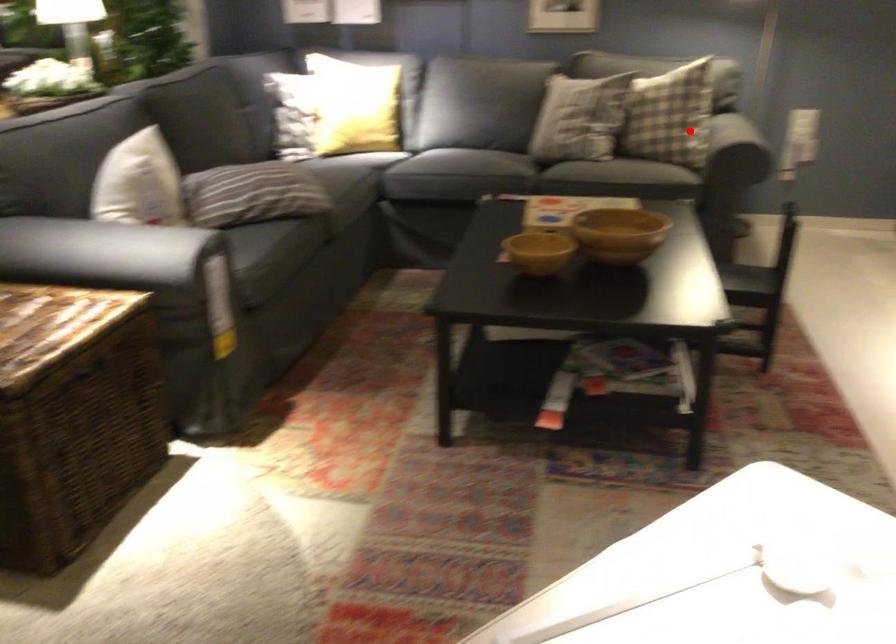
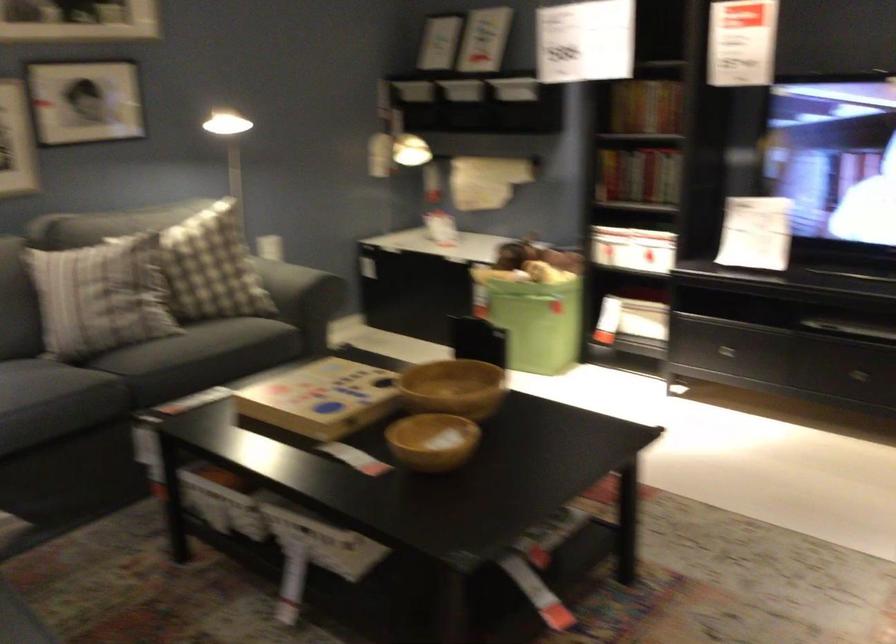
Locate, in the second image, the point that corresponds to the highlighted location in the first image.

(286, 285)